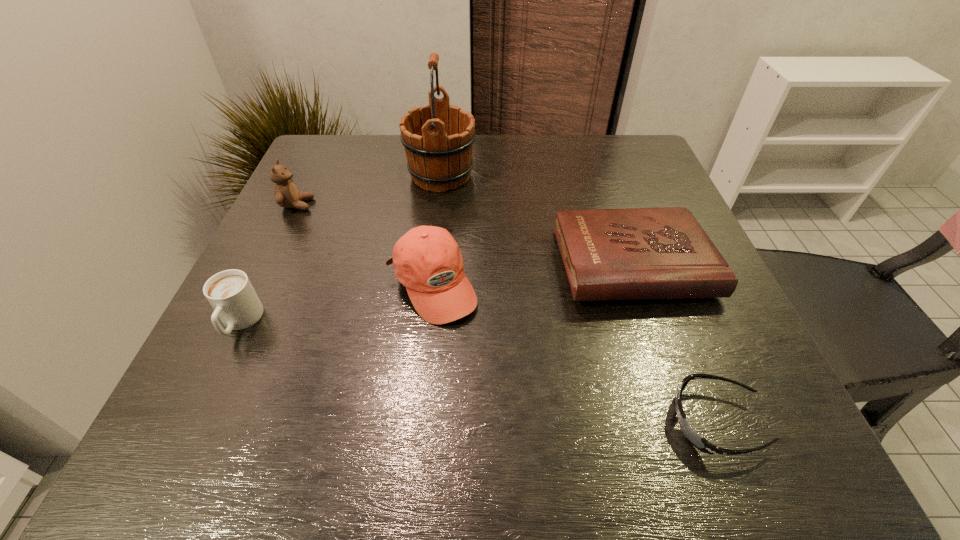
Where is `vacant space located on the side with the handle of the fourth tallest object`? vacant space located on the side with the handle of the fourth tallest object is located at coordinates (188, 432).

I want to click on free space located 0.260m on the front of the hardback book, so click(697, 453).

Locate an element on the screen. This screenshot has height=540, width=960. free space located 0.300m on the lenses of the shortest object is located at coordinates (468, 421).

What are the coordinates of `free space located 0.290m on the lenses of the shortest object` in the screenshot? It's located at (475, 421).

Find the location of a particular element. This screenshot has width=960, height=540. vacant area located 0.150m on the lenses of the shortest object is located at coordinates (570, 421).

Locate an element on the screen. Image resolution: width=960 pixels, height=540 pixels. object at the far edge is located at coordinates (438, 139).

Locate an element on the screen. The image size is (960, 540). object that is at the near edge is located at coordinates (692, 436).

This screenshot has width=960, height=540. I want to click on teddy bear that is at the left edge, so click(x=286, y=194).

The image size is (960, 540). In order to click on cappuccino located in the left edge section of the desktop in this screenshot , I will do `click(231, 294)`.

I want to click on hardback book situated at the right edge, so click(638, 253).